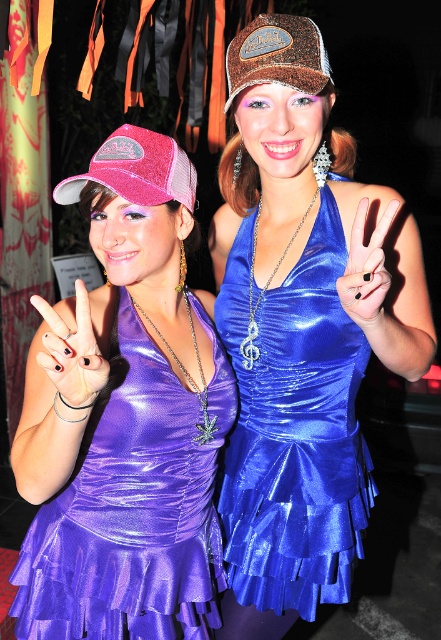
Question: Which of the following is the closest to the observer?

Choices:
 (A) (37, 300)
 (B) (369, 292)
 (C) (221, 500)
 (D) (90, 604)

Answer: (A)

Question: Which object appears closest to the camera in this image?

Choices:
 (A) shiny blue dress at center
 (B) black matte nails at center
 (C) pink glitter baseball cap at upper left

Answer: (B)

Question: Observing the image, what is the correct spatial positioning of pink glitter baseball cap at upper left in reference to glittery brown cap at upper center?

Choices:
 (A) below
 (B) above

Answer: (A)

Question: Does pink glitter baseball cap at upper left have a larger size compared to black matte hand at center?

Choices:
 (A) yes
 (B) no

Answer: (A)

Question: Estimate the real-world distances between objects in this image. Which object is farther from the purple shiny dress at center?

Choices:
 (A) pink glitter baseball cap at upper left
 (B) shiny blue dress at center

Answer: (A)

Question: Can you confirm if purple shiny dress at center is positioned above glittery brown cap at upper center?

Choices:
 (A) no
 (B) yes

Answer: (A)